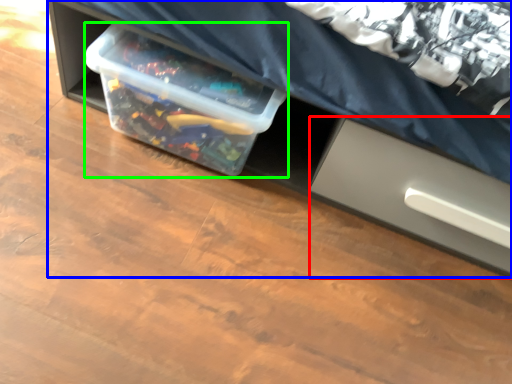
Question: Which object is positioned farthest from drawer (highlighted by a red box)? Select from furniture (highlighted by a blue box) and box (highlighted by a green box).

Choices:
 (A) furniture
 (B) box

Answer: (B)